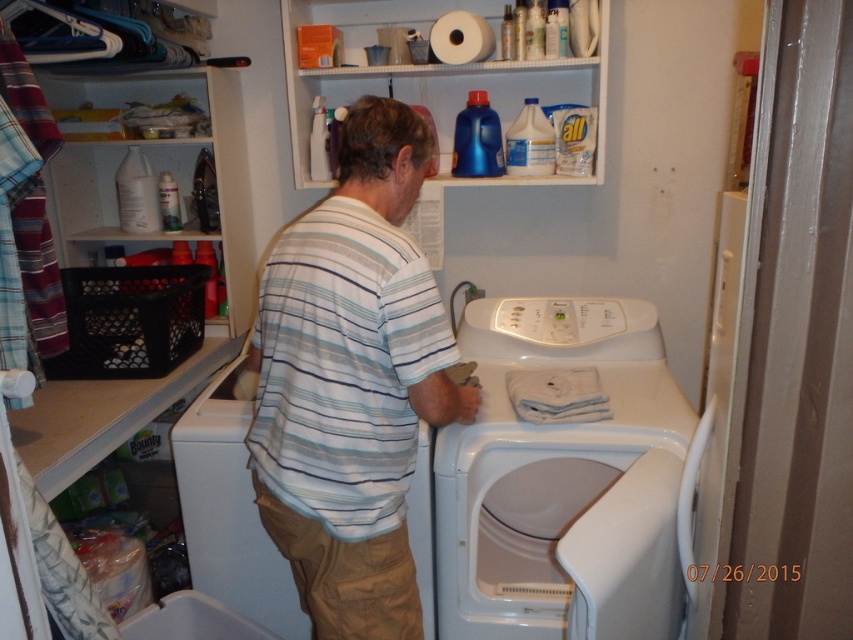
The man in the laundry room is wearing a horizontally striped shirt. There is a specific point marked at coordinates (351, 381). Based on the scene, where is this point located on the man?

The point (351, 381) is on the white striped shirt at center.

You are organizing the laundry room and need to place a new roll of paper towels. The existing white textured paper towel at upper center is already on the shelf above the white matte washing machine at center. Where should you place the new roll to maintain symmetry?

Place the new roll of paper towels to the left of the white textured paper towel at upper center, mirroring its position relative to the white matte washing machine at center since the white matte washing machine at center is to the left of the existing paper towel.

You are trying to reach the fabric softener bottle on the white plastic shelf at upper center while standing in front of the white glossy washing machine at center. Considering their positions, will you need to lean forward or backward to reach it?

The white glossy washing machine at center is closer to the viewer than the white plastic shelf at upper center, so you will need to lean forward to reach the fabric softener bottle on the white plastic shelf at upper center.